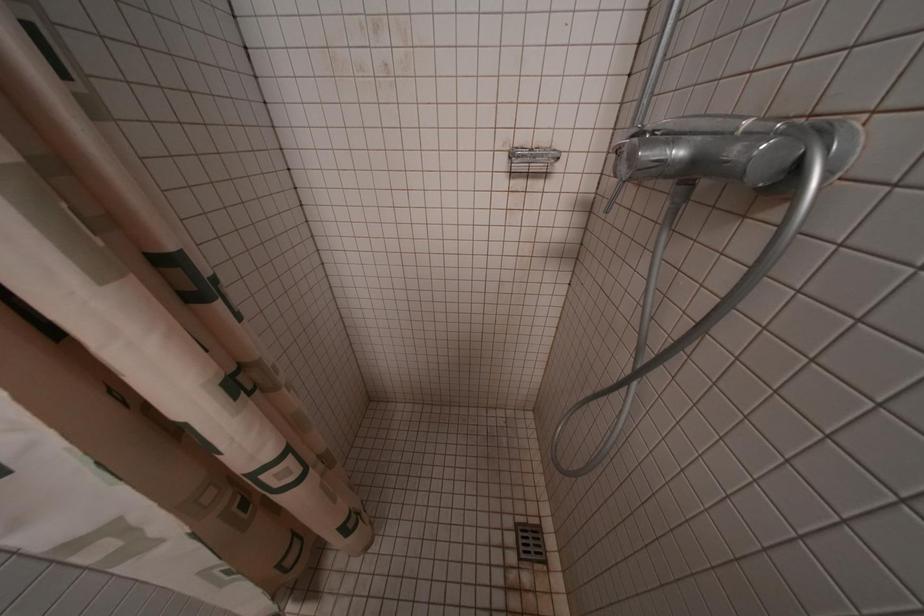
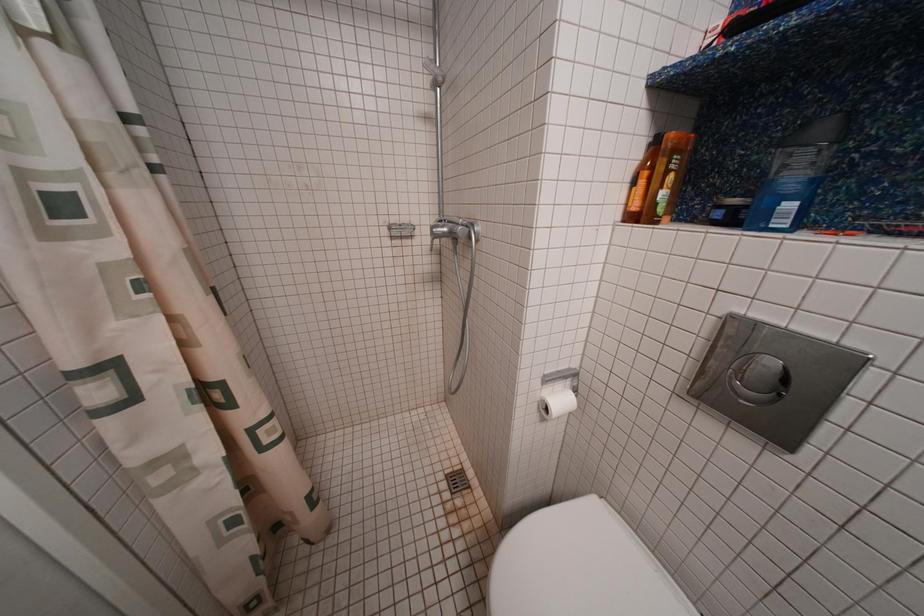
Question: How did the camera likely rotate?

Choices:
 (A) Left
 (B) Right
 (C) Up
 (D) Down

Answer: (B)